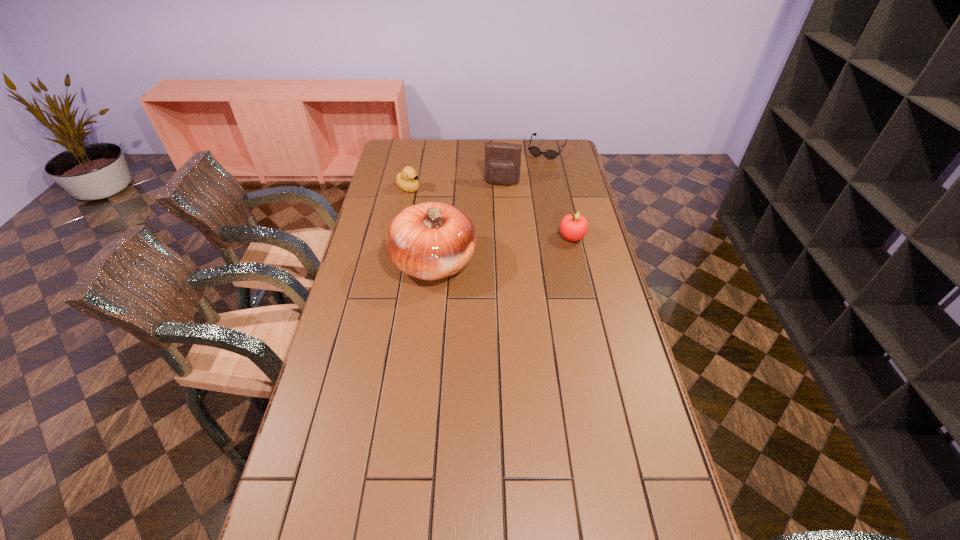
Where is `the closest object relative to the pouch`? This screenshot has height=540, width=960. the closest object relative to the pouch is located at coordinates (535, 151).

In order to click on free space that satisfies the following two spatial constraints: 1. on the front side of the duckling; 2. on the left side of the tallest object in this screenshot , I will do `click(393, 264)`.

This screenshot has height=540, width=960. In order to click on blank space that satisfies the following two spatial constraints: 1. on the back side of the pouch; 2. on the right side of the duckling in this screenshot , I will do `click(409, 183)`.